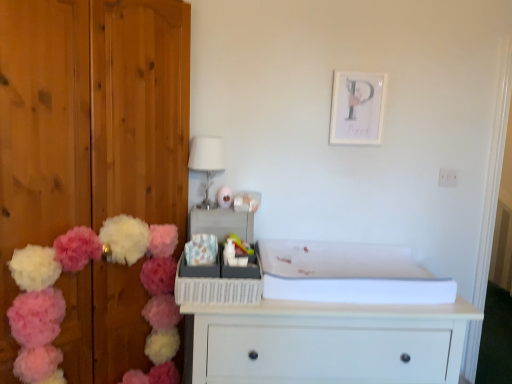
Question: Considering the relative positions of fluffy fabric flower at center and white matte picture frame at upper center in the image provided, is fluffy fabric flower at center to the left or to the right of white matte picture frame at upper center?

Choices:
 (A) right
 (B) left

Answer: (B)

Question: Considering their positions, is fluffy fabric flower at center located in front of or behind white matte picture frame at upper center?

Choices:
 (A) front
 (B) behind

Answer: (A)

Question: Estimate the real-world distances between objects in this image. Which object is farther from the white glossy lampshade at upper center?

Choices:
 (A) fluffy fabric flower at center
 (B) fluffy yarn pom-poms at left
 (C) matte plastic toy at center
 (D) white matte picture frame at upper center
 (E) wooden door at left

Answer: (D)

Question: Estimate the real-world distances between objects in this image. Which object is farther from the fluffy yarn pom-poms at left?

Choices:
 (A) matte plastic toy at center
 (B) white matte chest of drawers at center
 (C) white glossy lampshade at upper center
 (D) fluffy fabric flower at center
 (E) wooden door at left

Answer: (A)